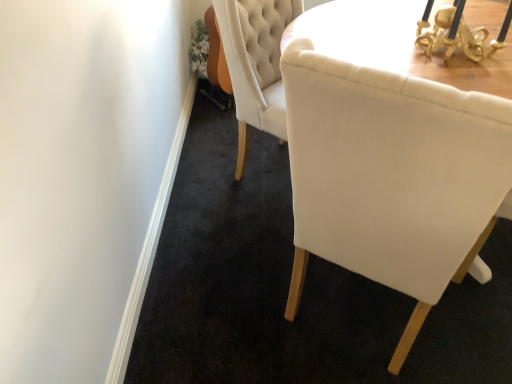
What is the approximate width of gold metallic table lamp at upper right?

The width of gold metallic table lamp at upper right is 10.91 inches.

What do you see at coordinates (458, 33) in the screenshot? I see `gold metallic table lamp at upper right` at bounding box center [458, 33].

In order to click on gold metallic table lamp at upper right in this screenshot , I will do `click(458, 33)`.

Where is `matte white chair at center`? This screenshot has width=512, height=384. matte white chair at center is located at coordinates pyautogui.click(x=390, y=175).

What do you see at coordinates (390, 175) in the screenshot? I see `matte white chair at center` at bounding box center [390, 175].

Find the location of `gold metallic table lamp at upper right`. gold metallic table lamp at upper right is located at coordinates (458, 33).

Can you confirm if matte white chair at center is positioned to the right of gold metallic table lamp at upper right?

No.

Is matte white chair at center in front of or behind gold metallic table lamp at upper right in the image?

matte white chair at center is in front of gold metallic table lamp at upper right.

Is point (360, 98) behind point (428, 39)?

That is False.

Consider the image. From the image's perspective, relative to gold metallic table lamp at upper right, is matte white chair at center above or below?

From the image's perspective, matte white chair at center appears below gold metallic table lamp at upper right.

From a real-world perspective, is matte white chair at center over gold metallic table lamp at upper right?

Actually, matte white chair at center is physically below gold metallic table lamp at upper right in the real world.

Considering the sizes of objects matte white chair at center and gold metallic table lamp at upper right in the image provided, who is thinner, matte white chair at center or gold metallic table lamp at upper right?

gold metallic table lamp at upper right.

From the picture: Which of these two, matte white chair at center or gold metallic table lamp at upper right, stands taller?

matte white chair at center.

Looking at this image, considering the relative sizes of matte white chair at center and gold metallic table lamp at upper right in the image provided, is matte white chair at center bigger than gold metallic table lamp at upper right?

Yes, matte white chair at center is bigger than gold metallic table lamp at upper right.

Is matte white chair at center outside of gold metallic table lamp at upper right?

Absolutely, matte white chair at center is external to gold metallic table lamp at upper right.

Is matte white chair at center placed right next to gold metallic table lamp at upper right?

No.

Is matte white chair at center facing towards gold metallic table lamp at upper right?

Yes, matte white chair at center faces towards gold metallic table lamp at upper right.

What's the angular difference between matte white chair at center and gold metallic table lamp at upper right's facing directions?

54.6 degrees.

How much distance is there between matte white chair at center and gold metallic table lamp at upper right?

matte white chair at center is 30.80 inches away from gold metallic table lamp at upper right.

I want to click on chair directly beneath the gold metallic table lamp at upper right (from a real-world perspective), so click(390, 175).

Between gold metallic table lamp at upper right and matte white chair at center, which one appears on the left side from the viewer's perspective?

Positioned to the left is matte white chair at center.

Is gold metallic table lamp at upper right in front of matte white chair at center?

No, it is behind matte white chair at center.

Is point (457, 17) farther from viewer compared to point (353, 130)?

Yes, point (457, 17) is farther from viewer.

From the image's perspective, which object appears higher, gold metallic table lamp at upper right or matte white chair at center?

From the image's view, gold metallic table lamp at upper right is above.

From a real-world perspective, who is located lower, gold metallic table lamp at upper right or matte white chair at center?

matte white chair at center is physically lower.

Is gold metallic table lamp at upper right wider or thinner than matte white chair at center?

In the image, gold metallic table lamp at upper right appears to be more narrow than matte white chair at center.

Is gold metallic table lamp at upper right shorter than matte white chair at center?

Yes, gold metallic table lamp at upper right is shorter than matte white chair at center.

Between gold metallic table lamp at upper right and matte white chair at center, which one has smaller size?

gold metallic table lamp at upper right.

Is matte white chair at center inside gold metallic table lamp at upper right?

No, matte white chair at center is not inside gold metallic table lamp at upper right.

Is gold metallic table lamp at upper right directly adjacent to matte white chair at center?

No, gold metallic table lamp at upper right is not with matte white chair at center.

Could you tell me if gold metallic table lamp at upper right is turned towards matte white chair at center?

No, gold metallic table lamp at upper right is not turned towards matte white chair at center.

Image resolution: width=512 pixels, height=384 pixels. I want to click on table lamp lying behind the matte white chair at center, so click(x=458, y=33).

I want to click on chair in front of the gold metallic table lamp at upper right, so click(390, 175).

Where is `table lamp on the right of matte white chair at center`? The height and width of the screenshot is (384, 512). table lamp on the right of matte white chair at center is located at coordinates (458, 33).